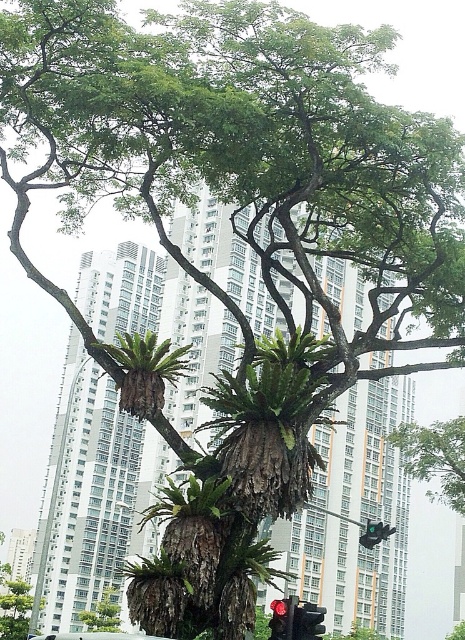
You are a gardener who wants to plant a new fern in your backyard. You have a space that can accommodate a plant up to 1 meter wide. You see the green rough bark fern at center and the green rough bark tree at lower left in the image. Which one would fit better in your space?

The green rough bark tree at lower left has a smaller width than the green rough bark fern at center, so it would fit better in a space that can accommodate up to 1 meter wide.

You are a botanist studying the tree in the image. You notice a green rough bark fern at center. Where exactly is it located in terms of coordinates?

The green rough bark fern at center is located at coordinates point [186,499].

You are a pedestrian waiting at a crosswalk near the white matte car at lower center and the green matte traffic light at center. Which object is bigger?

The white matte car at lower center is larger in size than the green matte traffic light at center.